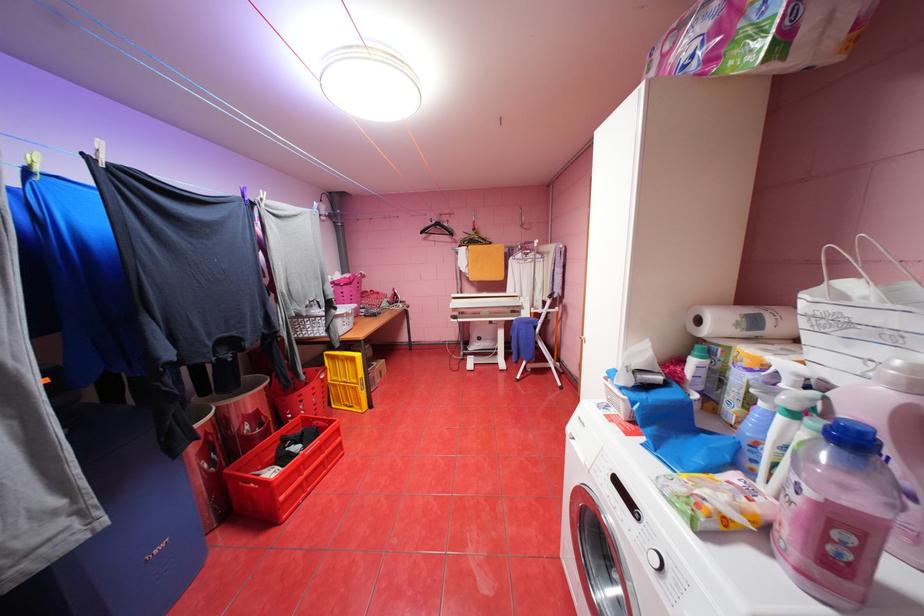
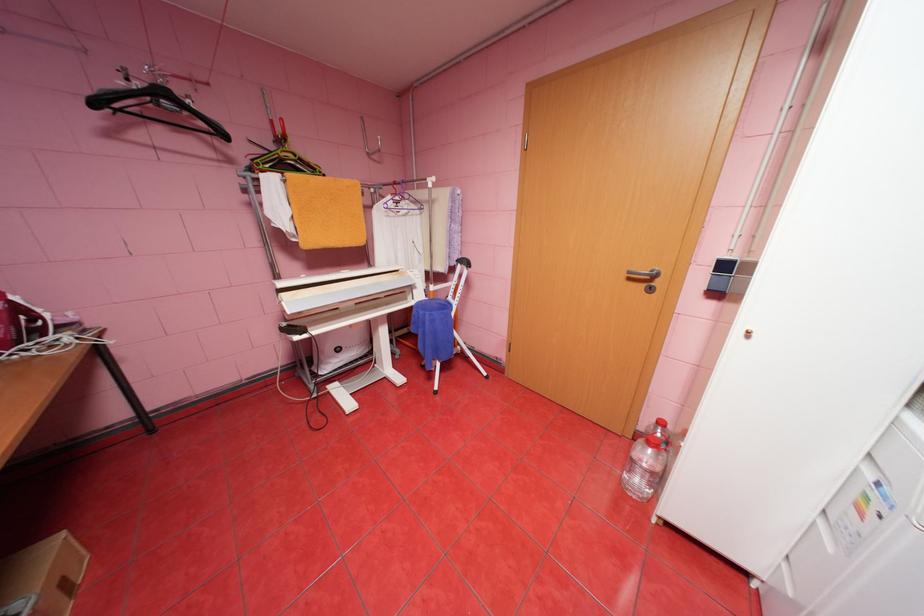
Find the pixel in the second image that matches pixel 431 232 in the first image.

(103, 103)